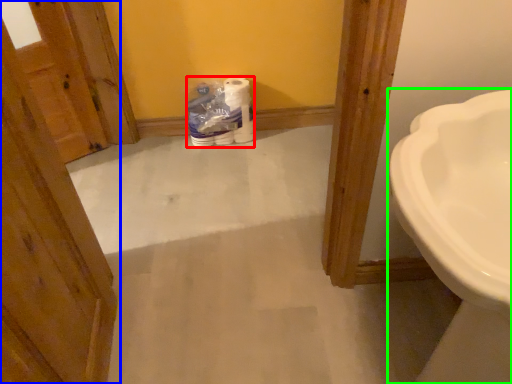
Question: Considering the real-world distances, which object is closest to toilet paper (highlighted by a red box)? door (highlighted by a blue box) or sink (highlighted by a green box).

Choices:
 (A) door
 (B) sink

Answer: (A)